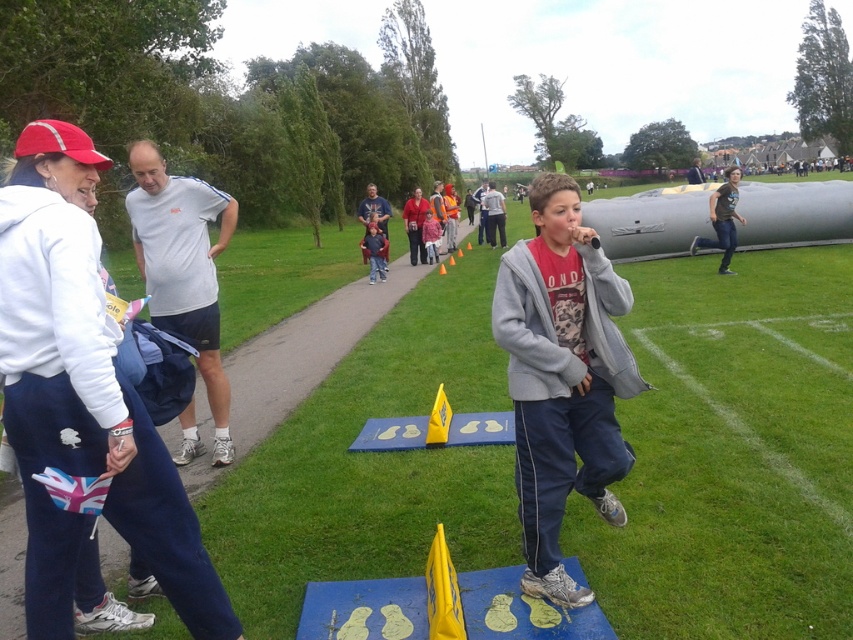
How far apart are red cotton hoodie at center and white fleece jacket at upper left?

red cotton hoodie at center is 1.83 meters away from white fleece jacket at upper left.

Does red cotton hoodie at center come behind white fleece jacket at upper left?

Yes, it is.

Locate an element on the screen. The height and width of the screenshot is (640, 853). red cotton hoodie at center is located at coordinates (561, 378).

Can you confirm if concrete sidewalk at center is positioned to the left of white fleece jacket at upper left?

Indeed, concrete sidewalk at center is positioned on the left side of white fleece jacket at upper left.

Does concrete sidewalk at center lie behind white fleece jacket at upper left?

Yes, it is behind white fleece jacket at upper left.

This screenshot has width=853, height=640. I want to click on concrete sidewalk at center, so click(310, 336).

At what (x,y) coordinates should I click in order to perform the action: click on concrete sidewalk at center. Please return your answer as a coordinate pair (x, y). Image resolution: width=853 pixels, height=640 pixels. Looking at the image, I should click on (310, 336).

Can you confirm if red cotton hoodie at center is positioned above concrete sidewalk at center?

No, red cotton hoodie at center is not above concrete sidewalk at center.

Find the location of a particular element. This screenshot has width=853, height=640. red cotton hoodie at center is located at coordinates (561, 378).

The image size is (853, 640). Find the location of `red cotton hoodie at center`. red cotton hoodie at center is located at coordinates (561, 378).